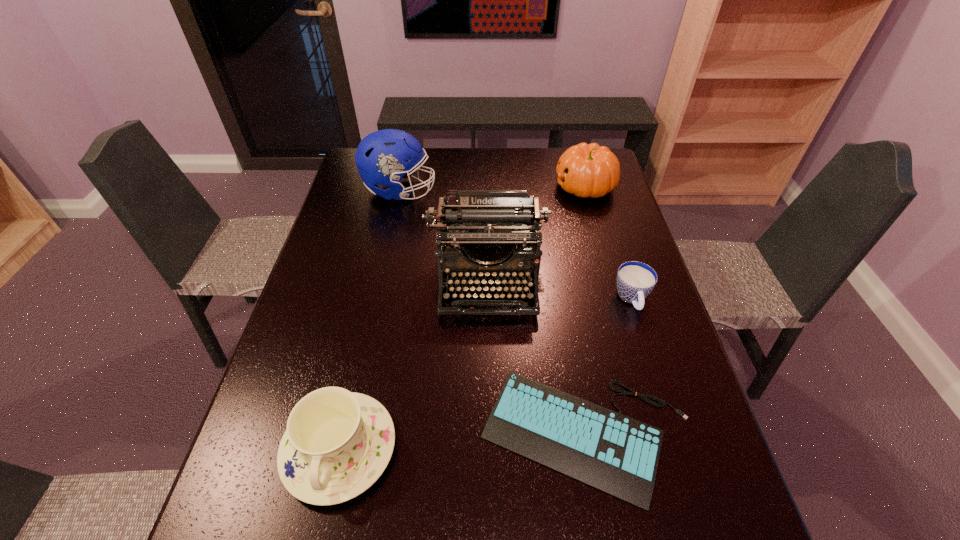
Locate an element on the screen. The width and height of the screenshot is (960, 540). blank space located 0.290m on the carved face of the pumpkin is located at coordinates (470, 187).

What are the coordinates of `free location located on the side of the second shortest object with the handle` in the screenshot? It's located at (661, 392).

The height and width of the screenshot is (540, 960). I want to click on vacant space located on the left of the shortest object, so click(364, 436).

At what (x,y) coordinates should I click in order to perform the action: click on football helmet that is at the far edge. Please return your answer as a coordinate pair (x, y). The height and width of the screenshot is (540, 960). Looking at the image, I should click on (382, 157).

Where is `pumpkin that is at the far edge`? pumpkin that is at the far edge is located at coordinates (586, 170).

What are the coordinates of `football helmet present at the left edge` in the screenshot? It's located at (382, 157).

The height and width of the screenshot is (540, 960). Identify the location of chinaware that is positioned at the left edge. (337, 443).

Find the location of `pumpkin situated at the right edge`. pumpkin situated at the right edge is located at coordinates (586, 170).

Where is `cup present at the right edge`? The width and height of the screenshot is (960, 540). cup present at the right edge is located at coordinates (635, 280).

At what (x,y) coordinates should I click in order to perform the action: click on computer keyboard at the right edge. Please return your answer as a coordinate pair (x, y). Image resolution: width=960 pixels, height=540 pixels. Looking at the image, I should click on (619, 455).